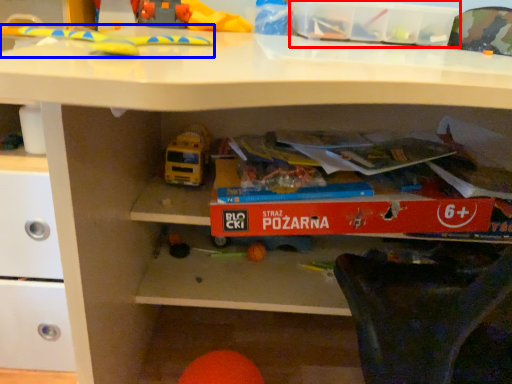
Question: Which of the following is the closest to the observer, storage box (highlighted by a red box) or toy (highlighted by a blue box)?

Choices:
 (A) storage box
 (B) toy

Answer: (B)